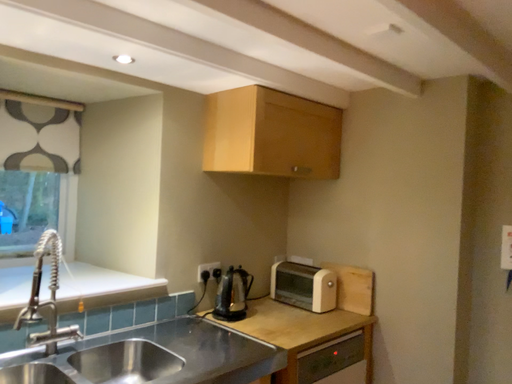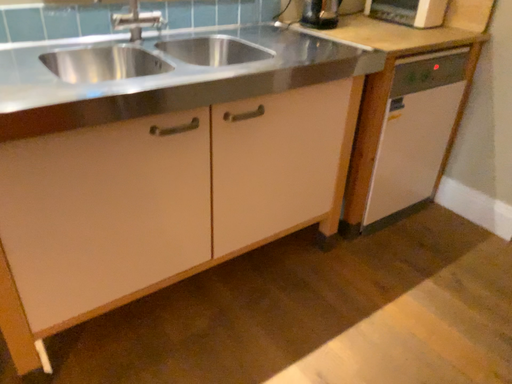
Question: Which way did the camera rotate in the video?

Choices:
 (A) rotated left
 (B) rotated right

Answer: (A)